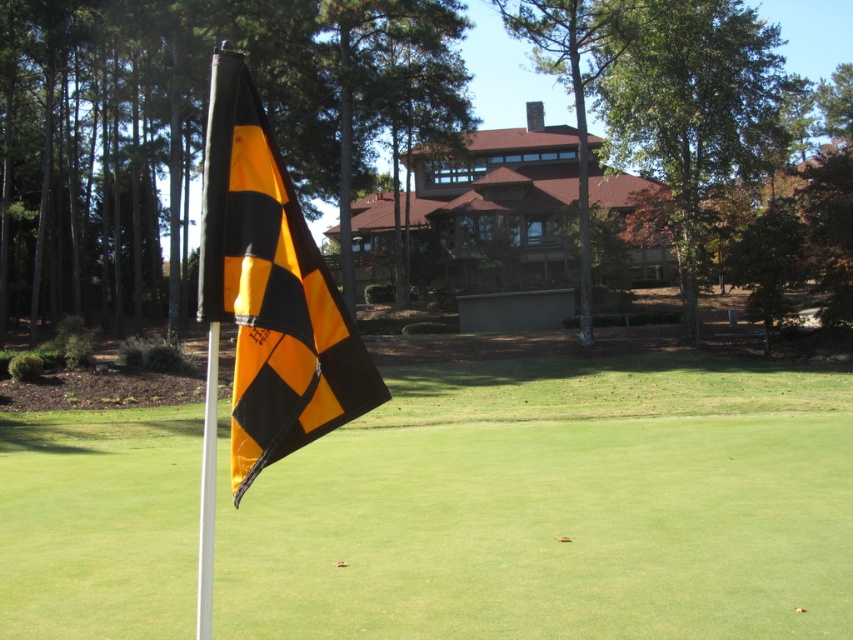
Is matte plastic flag at center further to the viewer compared to white metallic pole at center?

Yes, it is.

Looking at this image, is matte plastic flag at center bigger than white metallic pole at center?

No, matte plastic flag at center is not bigger than white metallic pole at center.

The width and height of the screenshot is (853, 640). What are the coordinates of `matte plastic flag at center` in the screenshot? It's located at (555, 508).

Does matte plastic flag at center lie in front of black/yellow checkered flag at center?

No, matte plastic flag at center is behind black/yellow checkered flag at center.

Image resolution: width=853 pixels, height=640 pixels. What are the coordinates of `matte plastic flag at center` in the screenshot? It's located at (555, 508).

Does black/yellow checkered flag at center appear on the left side of white metallic pole at center?

In fact, black/yellow checkered flag at center is to the right of white metallic pole at center.

Which is behind, point (231, 449) or point (202, 486)?

The point (231, 449) is more distant.

Does point (281, 275) lie behind point (206, 492)?

That is True.

I want to click on black/yellow checkered flag at center, so coord(270,291).